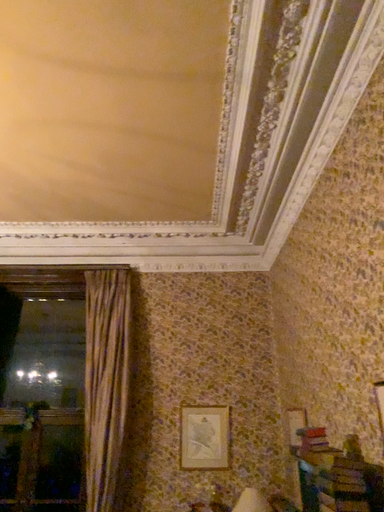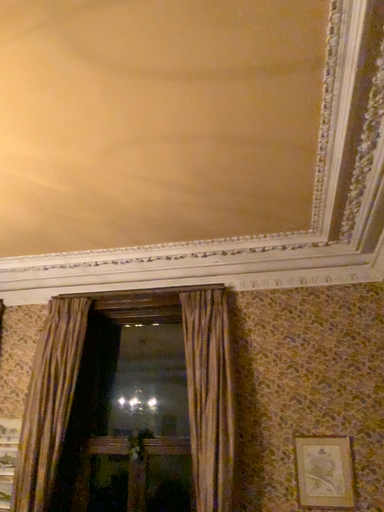
Question: Which way did the camera rotate in the video?

Choices:
 (A) rotated right
 (B) rotated left

Answer: (B)